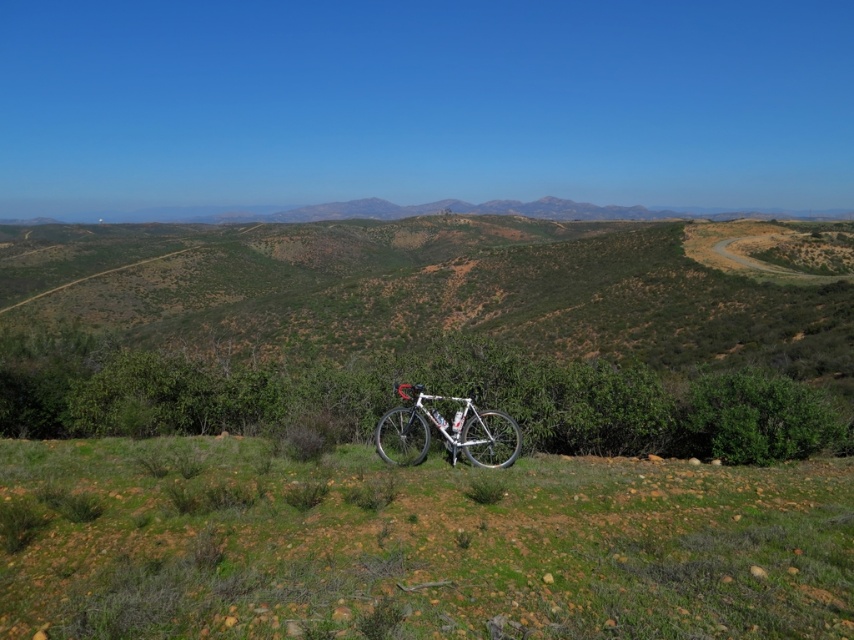
Who is higher up, green grassy at lower center or white metallic bicycle at center?

Positioned higher is white metallic bicycle at center.

At what (x,y) coordinates should I click in order to perform the action: click on green grassy at lower center. Please return your answer as a coordinate pair (x, y). Looking at the image, I should click on (427, 548).